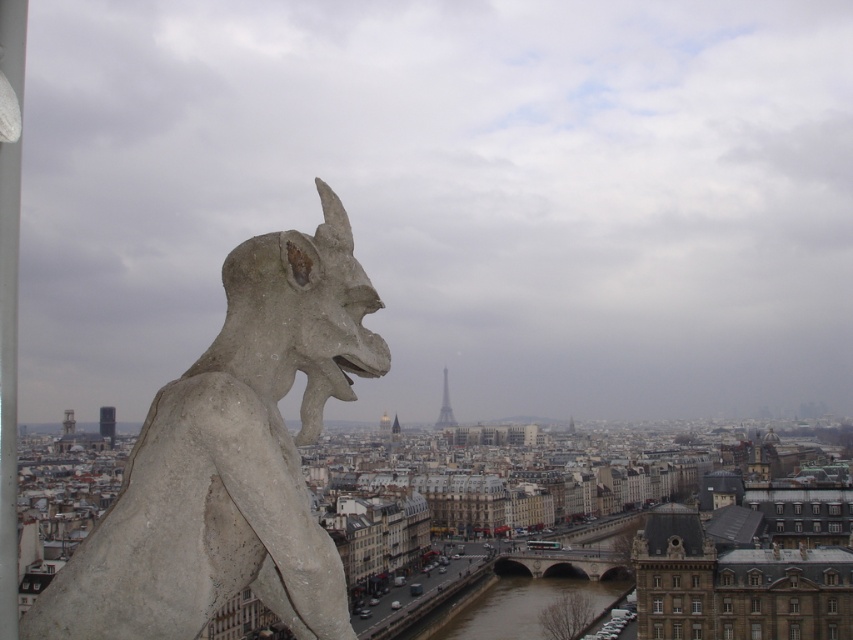
Question: Can you confirm if gray stone gargoyle at upper left is positioned below metallic silver tower at center?

Choices:
 (A) yes
 (B) no

Answer: (B)

Question: Is gray stone gargoyle at upper left wider than metallic silver tower at center?

Choices:
 (A) no
 (B) yes

Answer: (B)

Question: Which object is farther from the camera taking this photo?

Choices:
 (A) gray stone gargoyle at upper left
 (B) metallic silver tower at center

Answer: (B)

Question: Which of the following is the closest to the observer?

Choices:
 (A) (296, 291)
 (B) (436, 426)

Answer: (A)

Question: Can you confirm if gray stone gargoyle at upper left is thinner than metallic silver tower at center?

Choices:
 (A) no
 (B) yes

Answer: (A)